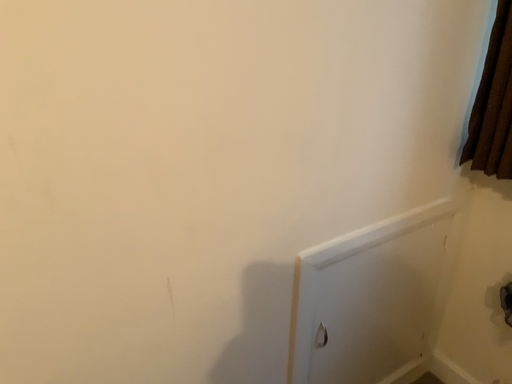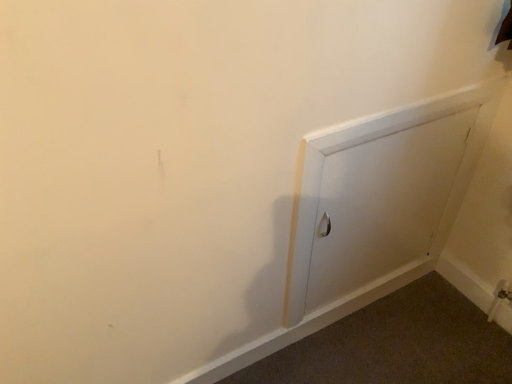
Question: How did the camera likely rotate when shooting the video?

Choices:
 (A) rotated upward
 (B) rotated downward

Answer: (B)